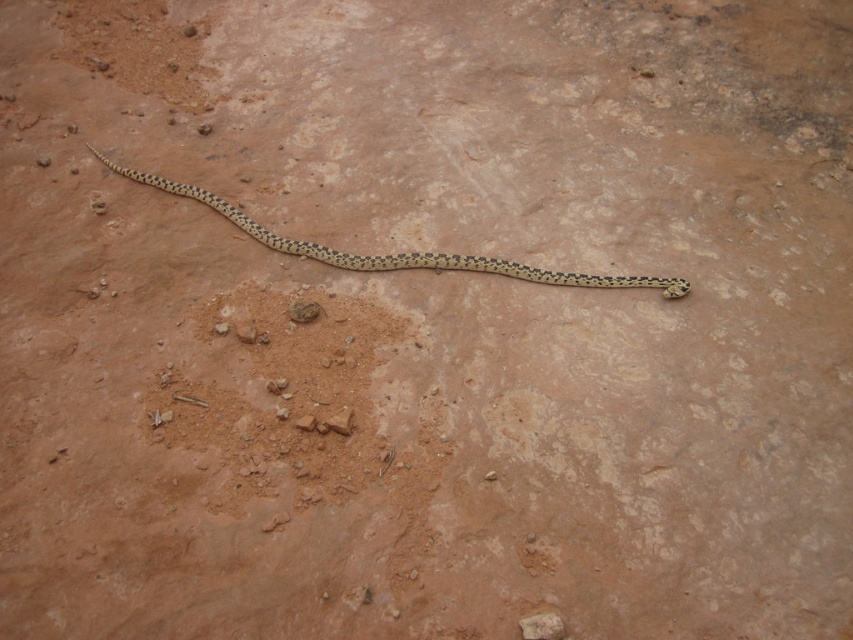
You are an animal tracker trying to identify the location of a speckled skin snake at center. You have a map with a coordinate system where the bottom left corner is the origin. The snake is lying on a dry soil surface. Can you determine if the point at coordinate point (x=393, y=253) is on the snake?

The point (x=393, y=253) is on the speckled skin snake at center, so yes, the point is on the snake.

You are a hiker who spots the speckled skin snake at center and the brown rough rock at center on the ground. Which object is closer to you?

The speckled skin snake at center is closer to you because it is positioned above the brown rough rock at center, indicating it is nearer in the scene.